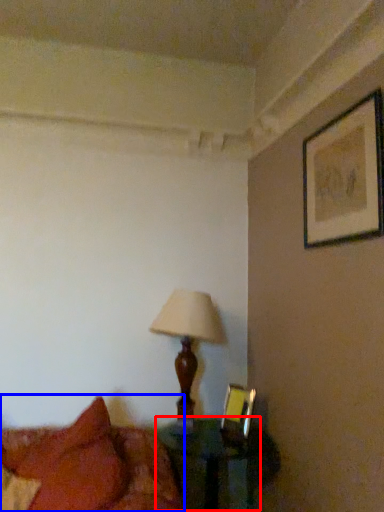
Question: Which object appears farthest to the camera in this image, table (highlighted by a red box) or bed (highlighted by a blue box)?

Choices:
 (A) table
 (B) bed

Answer: (A)